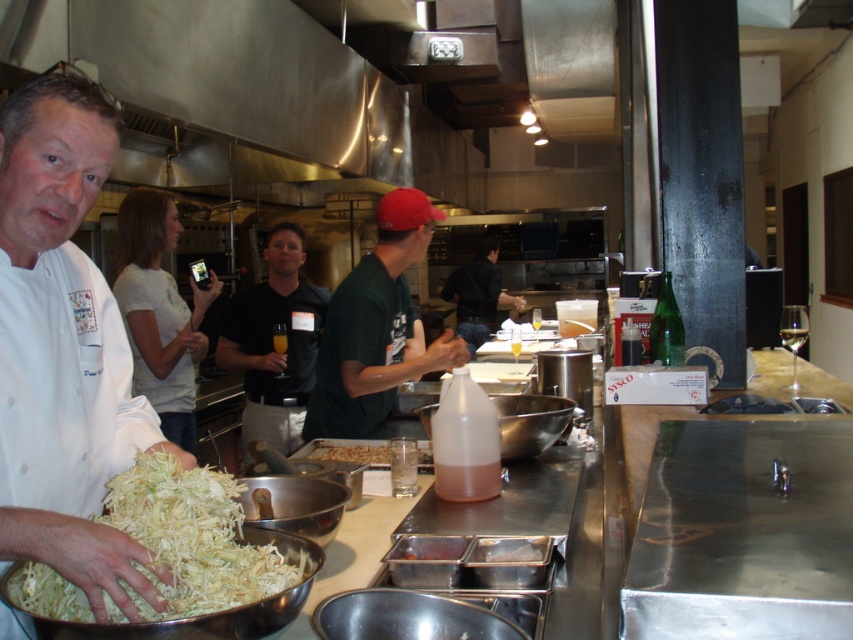
Does point (21, 396) come closer to viewer compared to point (276, 316)?

Yes, point (21, 396) is in front of point (276, 316).

Which is more to the left, white chef coat at center or black matte shirt at center?

From the viewer's perspective, black matte shirt at center appears more on the left side.

Between point (9, 236) and point (294, 387), which one is positioned behind?

The point (294, 387) is behind.

Where is `white chef coat at center`? white chef coat at center is located at coordinates (64, 349).

Between green matte shirt at center and black matte shirt at center, which one appears on the right side from the viewer's perspective?

Positioned to the right is green matte shirt at center.

Which of these two, green matte shirt at center or black matte shirt at center, stands shorter?

green matte shirt at center is shorter.

Who is more forward, [426,356] or [305,310]?

Point [426,356] is in front.

This screenshot has width=853, height=640. Find the location of `green matte shirt at center`. green matte shirt at center is located at coordinates (376, 326).

Does point (39, 460) lie in front of point (337, 298)?

Yes, point (39, 460) is in front of point (337, 298).

Is white chef coat at center shorter than green matte shirt at center?

Yes.

Between point (84, 372) and point (405, 253), which one is positioned behind?

The point (405, 253) is more distant.

The width and height of the screenshot is (853, 640). Find the location of `white chef coat at center`. white chef coat at center is located at coordinates (64, 349).